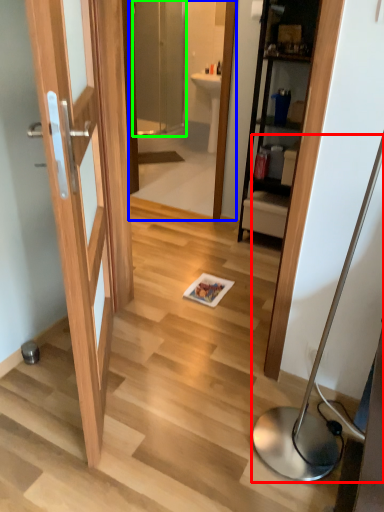
Question: Estimate the real-world distances between objects in this image. Which object is farther from table lamp (highlighted by a red box), mirror (highlighted by a blue box) or screen door (highlighted by a green box)?

Choices:
 (A) mirror
 (B) screen door

Answer: (B)